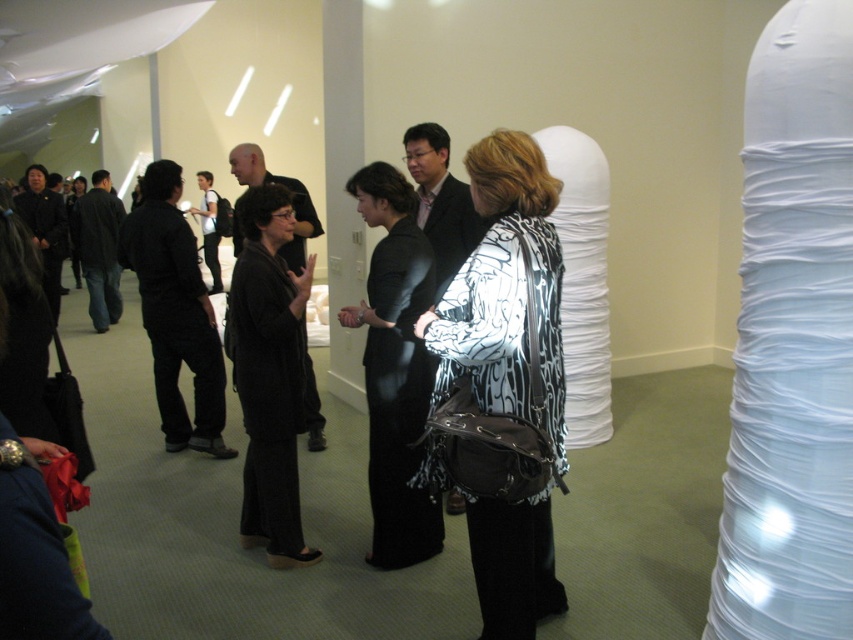
Question: Is printed fabric jacket at center positioned in front of black silk dress at center?

Choices:
 (A) yes
 (B) no

Answer: (A)

Question: Is printed fabric jacket at center bigger than black silk dress at center?

Choices:
 (A) no
 (B) yes

Answer: (B)

Question: Which point appears closest to the camera in this image?

Choices:
 (A) (422, 301)
 (B) (561, 272)

Answer: (B)

Question: Is printed fabric jacket at center to the right of black silk dress at center from the viewer's perspective?

Choices:
 (A) yes
 (B) no

Answer: (A)